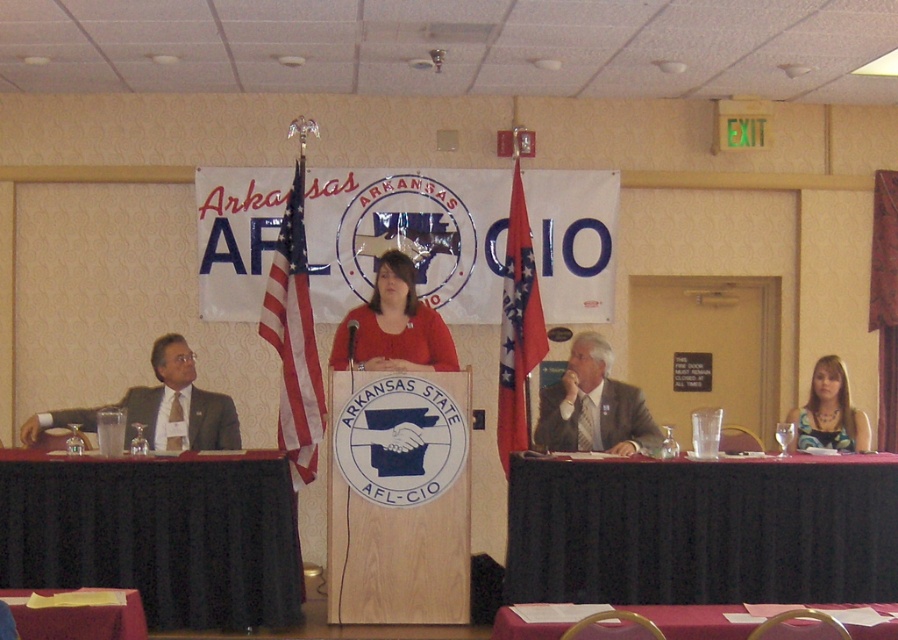
You are a photographer at the event and need to capture a photo where both the gray suit at center and the smooth red tablecloth at lower center are visible. Given their heights, which object should you ensure is closer to the camera to avoid being blocked by the other?

The gray suit at center is taller than the smooth red tablecloth at lower center, so you should position the smooth red tablecloth at lower center closer to the camera to prevent it from being blocked by the taller gray suit at center.

You are a photographer at the event and want to position yourself such that the Arkansas state flag, the American flag, and the gray suit at center are all visible in your shot. Given their positions, where should you stand relative to the podium to capture all three elements in your frame?

To capture the Arkansas state flag, the American flag, and the gray suit at center in your shot, you should position yourself in front of the podium, ensuring that the flags on either side of the banner and the speaker in the gray suit at center are within your camera frame.